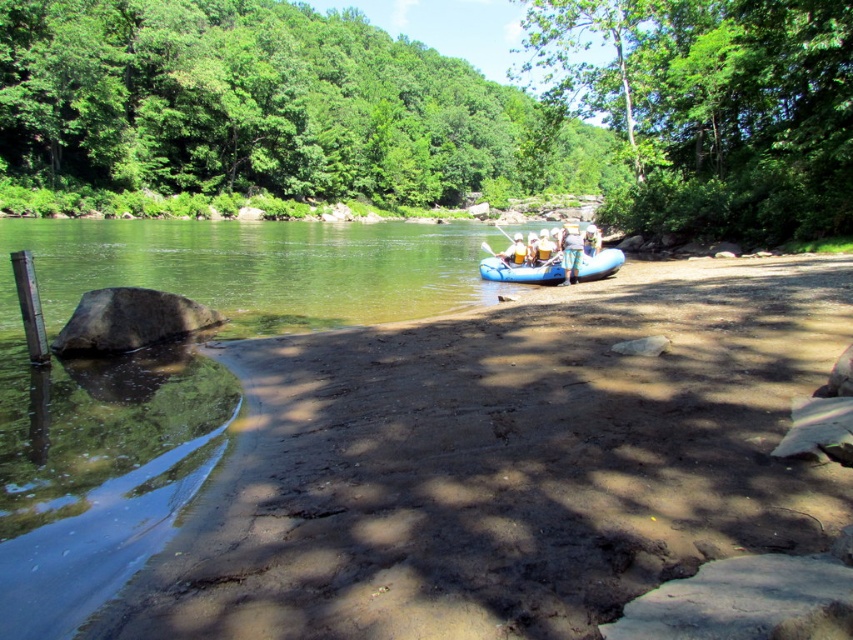
You are standing on the riverside and see a blue rubber raft at center and a yellow fabric shirt at center. Which object is closer to you?

The blue rubber raft at center is 1.79 meters from the yellow fabric shirt at center, so the distance between them is 1.79 meters. However, the question asks which is closer to you, but the description only provides the distance between the two objects. Without additional information about their positions relative to the observer, it is impossible to determine which is closer to you based on the given description.

You are a photographer planning to take a photo of the blue rubber raft at center and the yellow fabric shirt at center in the riverside scene. Which object should you focus on first if you want to capture the smaller one in detail?

The blue rubber raft at center is smaller than the yellow fabric shirt at center, so you should focus on the blue rubber raft at center first to capture it in detail.